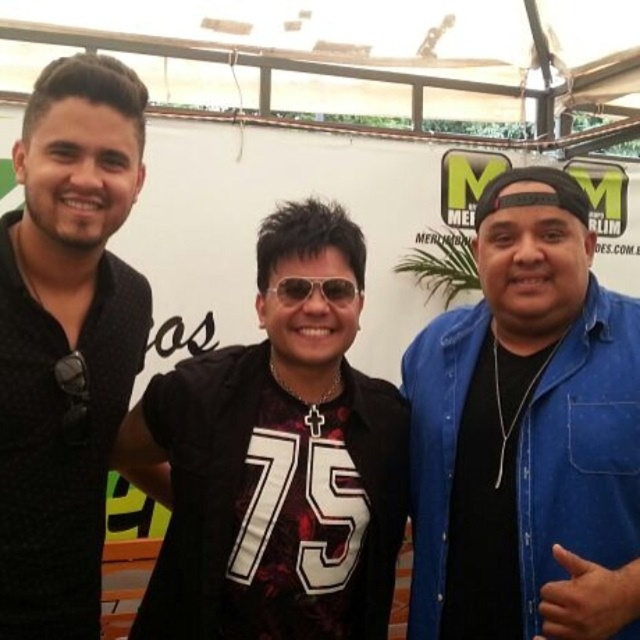
In the scene described, there are two items of clothing or accessories visible. One is the blue denim shirt at right, and the other is the black matte sunglasses at center. From the perspective of someone standing in front of the image, which item is positioned to the left?

The black matte sunglasses at center are positioned to the left of the blue denim shirt at right.

You are a photographer trying to adjust the lighting for a group photo. You notice two items in the scene that need even lighting coverage. The items are the blue denim shirt at right and the black matte sunglasses at center. Based on their sizes, which item requires a wider light source to ensure proper illumination?

The blue denim shirt at right is much taller than the black matte sunglasses at center, so it requires a wider light source to ensure proper illumination.